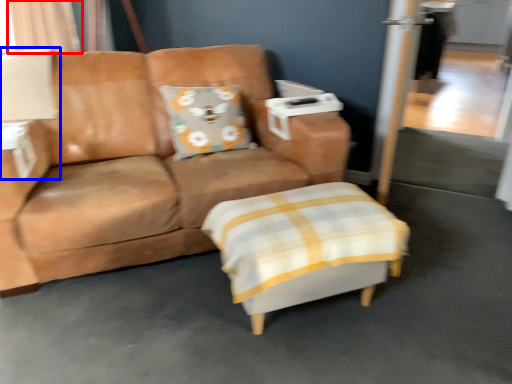
Question: Among these objects, which one is nearest to the camera, curtain (highlighted by a red box) or table lamp (highlighted by a blue box)?

Choices:
 (A) curtain
 (B) table lamp

Answer: (B)